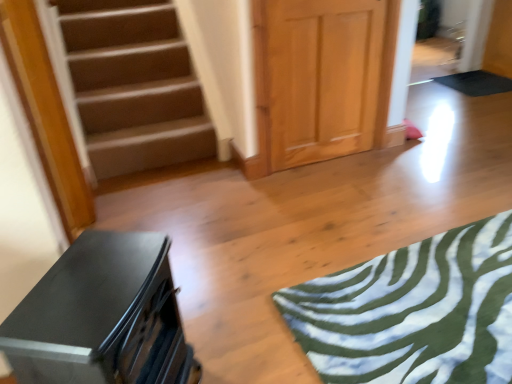
Question: Considering the relative positions of matte black dresser at lower left and black rubber yoga mat at upper right, the 2th yoga mat ordered from the bottom, in the image provided, is matte black dresser at lower left to the left of black rubber yoga mat at upper right, the 2th yoga mat ordered from the bottom, from the viewer's perspective?

Choices:
 (A) no
 (B) yes

Answer: (B)

Question: Is matte black dresser at lower left to the right of black rubber yoga mat at upper right, the 2th yoga mat ordered from the bottom, from the viewer's perspective?

Choices:
 (A) no
 (B) yes

Answer: (A)

Question: From the image's perspective, is matte black dresser at lower left under black rubber yoga mat at upper right, the 1th yoga mat when ordered from top to bottom?

Choices:
 (A) yes
 (B) no

Answer: (A)

Question: Does matte black dresser at lower left have a lesser height compared to black rubber yoga mat at upper right, the 2th yoga mat from the left?

Choices:
 (A) yes
 (B) no

Answer: (B)

Question: Is matte black dresser at lower left taller than black rubber yoga mat at upper right, the 2th yoga mat viewed from the front?

Choices:
 (A) yes
 (B) no

Answer: (A)

Question: Is matte black dresser at lower left positioned beyond the bounds of black rubber yoga mat at upper right, which is counted as the first yoga mat, starting from the right?

Choices:
 (A) yes
 (B) no

Answer: (A)

Question: Does light wood paneling at center lie in front of matte black dresser at lower left?

Choices:
 (A) no
 (B) yes

Answer: (A)

Question: Are light wood paneling at center and matte black dresser at lower left making contact?

Choices:
 (A) yes
 (B) no

Answer: (B)

Question: Is matte black dresser at lower left located within light wood paneling at center?

Choices:
 (A) no
 (B) yes

Answer: (A)

Question: From a real-world perspective, is light wood paneling at center physically below matte black dresser at lower left?

Choices:
 (A) no
 (B) yes

Answer: (A)

Question: Is light wood paneling at center to the right of matte black dresser at lower left from the viewer's perspective?

Choices:
 (A) no
 (B) yes

Answer: (B)

Question: Is light wood paneling at center thinner than matte black dresser at lower left?

Choices:
 (A) yes
 (B) no

Answer: (A)

Question: Is light wood paneling at center thinner than green fabric yoga mat at lower right, which ranks as the 1th yoga mat in bottom-to-top order?

Choices:
 (A) no
 (B) yes

Answer: (B)